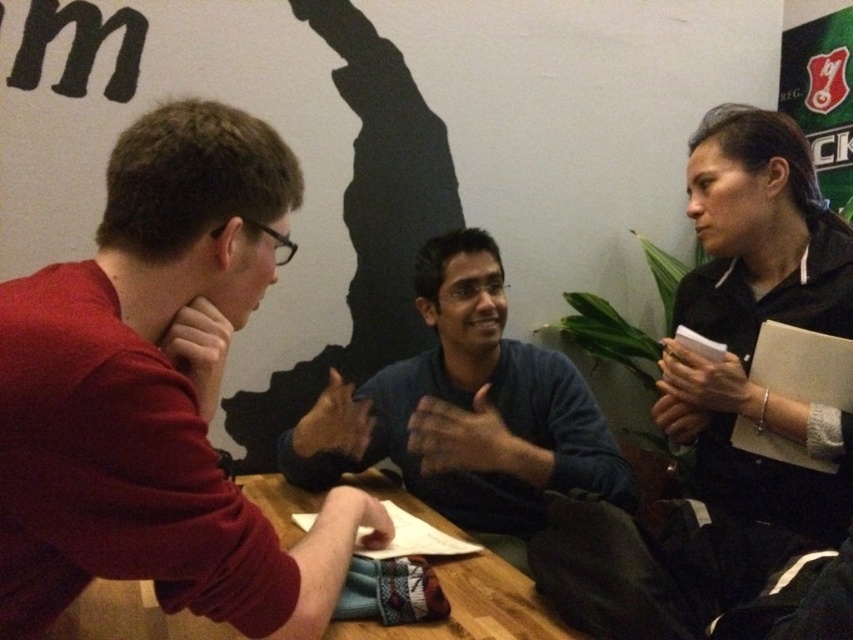
Can you confirm if black matte jacket at upper right is bigger than wooden table at center?

Indeed, black matte jacket at upper right has a larger size compared to wooden table at center.

From the picture: Does black matte jacket at upper right have a greater height compared to wooden table at center?

Yes.

In the scene shown: Who is more distant from viewer, (767,173) or (71,627)?

Positioned behind is point (767,173).

The width and height of the screenshot is (853, 640). Identify the location of black matte jacket at upper right. (758, 330).

Who is lower down, matte red sweater at left or wooden table at center?

wooden table at center is below.

Is point (59, 512) positioned after point (100, 595)?

No, it is not.

Who is more forward, [33,275] or [450,637]?

Positioned in front is point [450,637].

This screenshot has height=640, width=853. Identify the location of matte red sweater at left. (155, 394).

Can you confirm if matte red sweater at left is wider than dark blue sweater at center?

No.

This screenshot has height=640, width=853. I want to click on matte red sweater at left, so click(x=155, y=394).